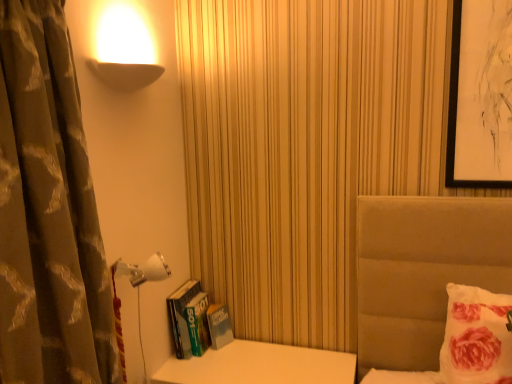
Question: From the image's perspective, is hardcover book at left above or below fluffy white pillow at right?

Choices:
 (A) below
 (B) above

Answer: (A)

Question: Looking at their shapes, would you say hardcover book at left is wider or thinner than fluffy white pillow at right?

Choices:
 (A) thin
 (B) wide

Answer: (B)

Question: Considering the real-world distances, which object is farthest from the fluffy white pillow at right?

Choices:
 (A) white glossy table at lower left
 (B) brown textured curtain at left
 (C) white plastic lamp at lower left
 (D) hardcover book at left

Answer: (B)

Question: Which object is positioned closest to the fluffy white pillow at right?

Choices:
 (A) white glossy table at lower left
 (B) hardcover book at left
 (C) brown textured curtain at left
 (D) white plastic lamp at lower left

Answer: (A)